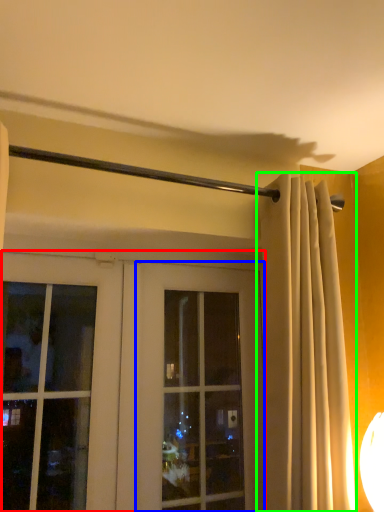
Question: Which object is positioned closest to door (highlighted by a red box)? Select from window (highlighted by a blue box) and curtain (highlighted by a green box).

Choices:
 (A) window
 (B) curtain

Answer: (A)